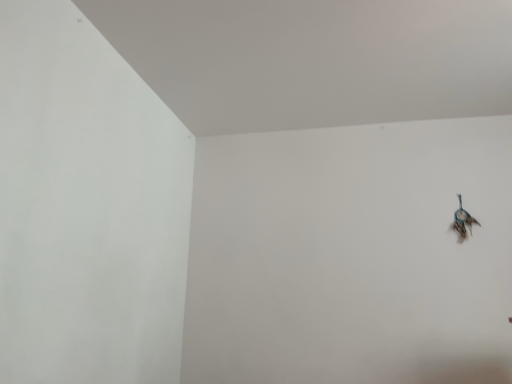
Describe the element at coordinates (462, 222) in the screenshot. I see `metallic blue dreamcatcher at upper right` at that location.

Identify the location of metallic blue dreamcatcher at upper right. click(x=462, y=222).

Where is `metallic blue dreamcatcher at upper right`? Image resolution: width=512 pixels, height=384 pixels. metallic blue dreamcatcher at upper right is located at coordinates (462, 222).